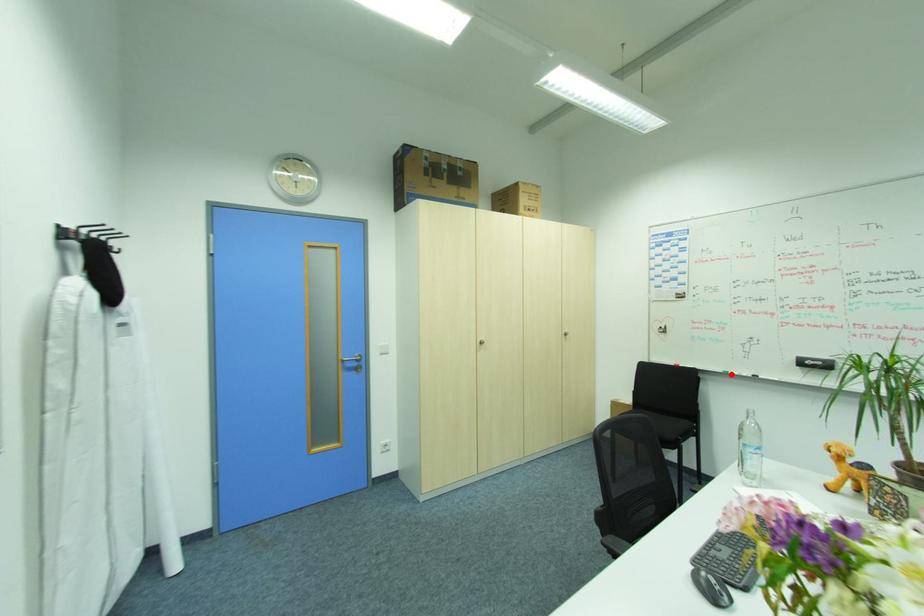
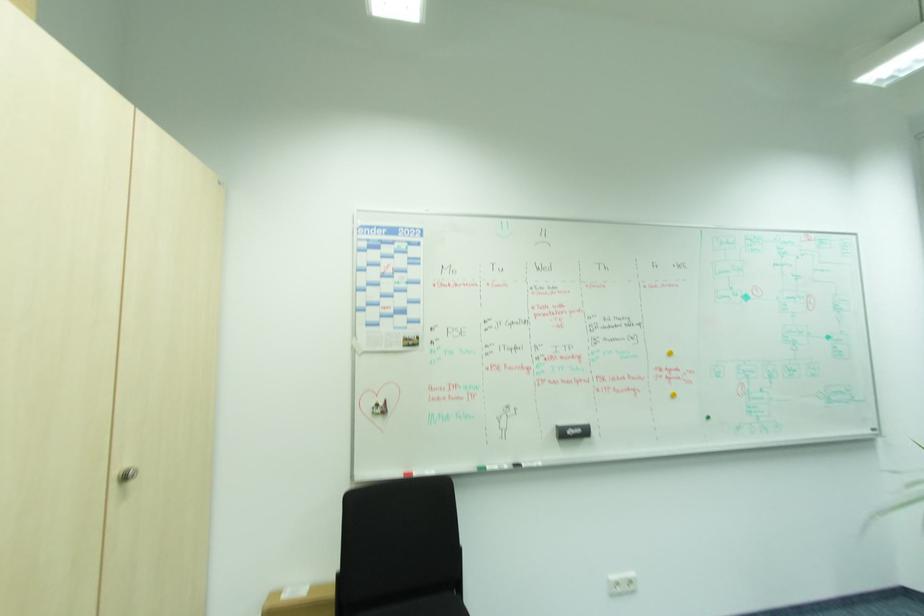
Find the pixel in the second image that matches the highlighted location in the first image.

(487, 471)